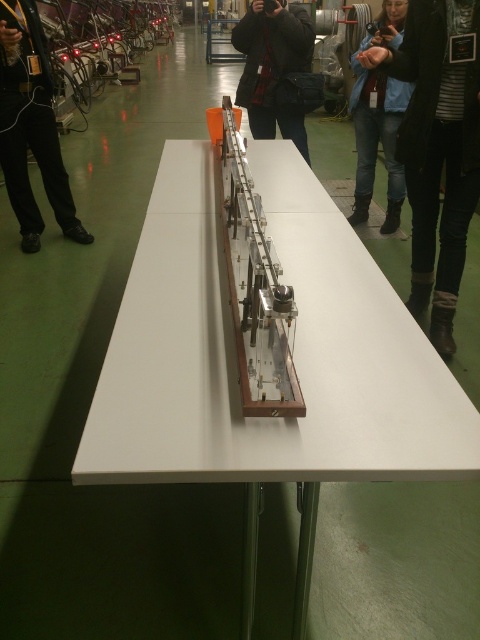
Question: Which point is closer to the camera?

Choices:
 (A) (239, 93)
 (B) (456, 273)
 (C) (34, 211)
 (D) (160, 452)

Answer: (D)

Question: Estimate the real-world distances between objects in this image. Which object is closer to the white glossy table at center?

Choices:
 (A) black leather pants at left
 (B) black leather jacket at center
 (C) blue jeans at center
 (D) denim jacket at upper right

Answer: (D)

Question: Can you confirm if white glossy table at center is positioned below black leather pants at left?

Choices:
 (A) no
 (B) yes

Answer: (B)

Question: Does denim jacket at upper right have a smaller size compared to black leather pants at left?

Choices:
 (A) yes
 (B) no

Answer: (B)

Question: Estimate the real-world distances between objects in this image. Which object is farther from the black leather pants at left?

Choices:
 (A) blue jeans at center
 (B) white glossy table at center

Answer: (A)

Question: Is black leather pants at left closer to the viewer compared to blue jeans at center?

Choices:
 (A) no
 (B) yes

Answer: (B)